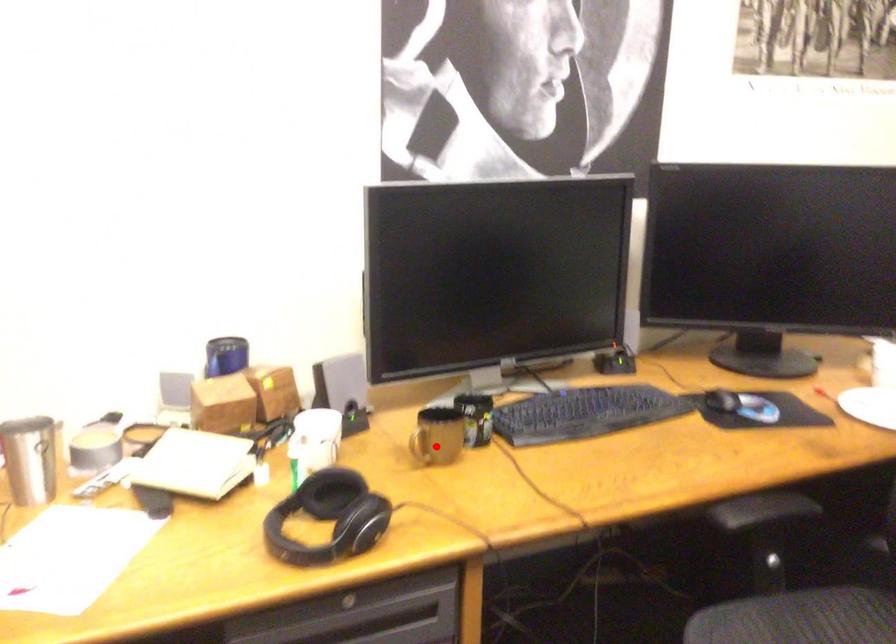
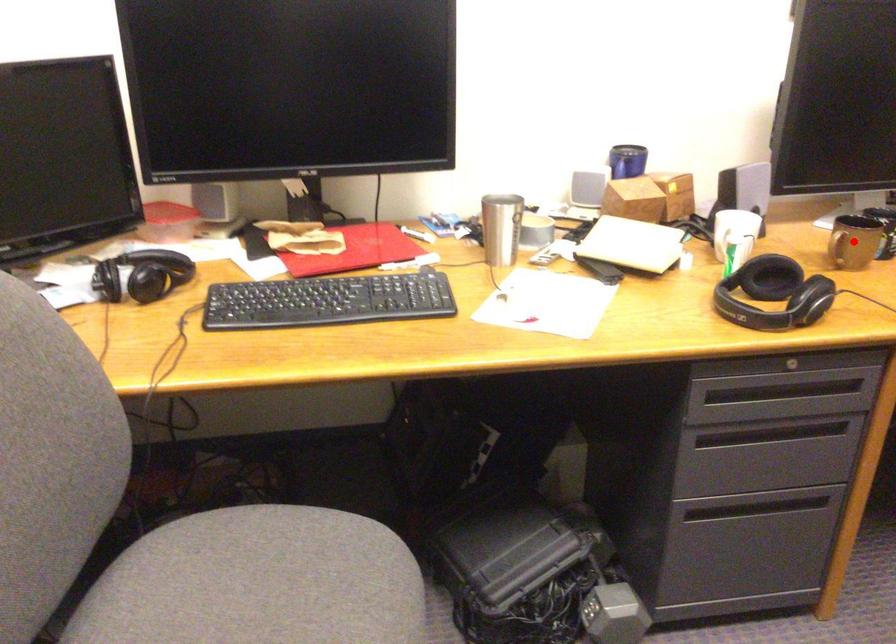
I am providing you with two images of the same scene from different viewpoints. A red point is marked on the first image and another point is marked on the second image. Are the points marked in image1 and image2 representing the same 3D position?

Yes